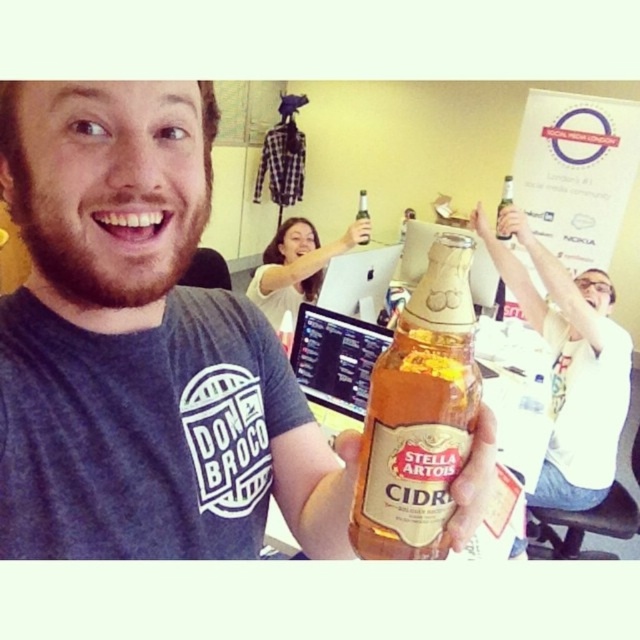
Question: Which point is closer to the camera taking this photo?

Choices:
 (A) (499, 205)
 (B) (67, 467)

Answer: (B)

Question: Among these objects, which one is nearest to the camera?

Choices:
 (A) translucent glass bottle at center
 (B) matte gold beer bottle at upper center
 (C) golden glass bottle at upper center
 (D) white matte shirt at upper right

Answer: (D)

Question: Which of the following is the closest to the observer?

Choices:
 (A) 225,356
 (B) 381,426
 (C) 508,204

Answer: (B)

Question: Is white matte shirt at upper right positioned at the back of matte gold beer bottle at upper center?

Choices:
 (A) no
 (B) yes

Answer: (A)

Question: Where is matte white hand at upper center located in relation to translucent glass bottle at center in the image?

Choices:
 (A) left
 (B) right

Answer: (A)

Question: Is white matte shirt at upper right thinner than translucent glass bottle at center?

Choices:
 (A) yes
 (B) no

Answer: (B)